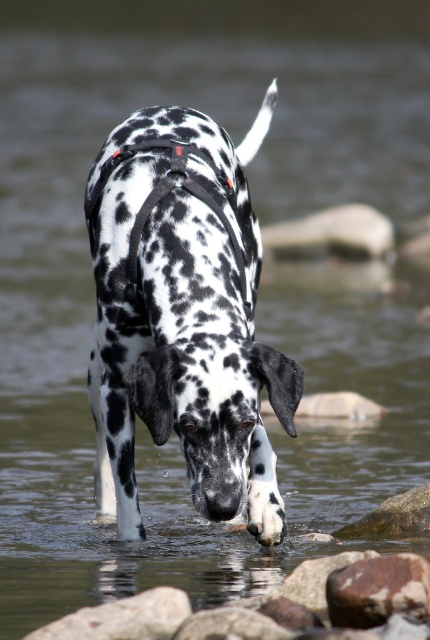
In the scene shown: You are a photographer trying to capture the Dalmatian dog in the stream. You notice two points marked in the image. The first point is at coordinate point (x=306, y=616), and the second is at point (x=156, y=605). Which point is closer to the camera?

Point (x=156, y=605) is closer to the camera because the description states that point (x=306, y=616) is further away from the camera than point (x=156, y=605).

You are a photographer trying to capture the Dalmatian dog in the stream. You notice two points marked on your camera screen at coordinates point (362, 634) and point (337, 586). Which point is closer to the dog?

Point (362, 634) is in front of point (337, 586), so it is closer to the dog.

You are standing at the edge of a stream and see the smooth brown rock at lower center. If you want to place a 10 feet long fishing rod on the ground between you and the rock, will it fit?

The smooth brown rock at lower center is 8.52 feet away from the viewer. Since the fishing rod is 10 feet long, it will not fit between you and the rock as the distance is shorter than the rod.